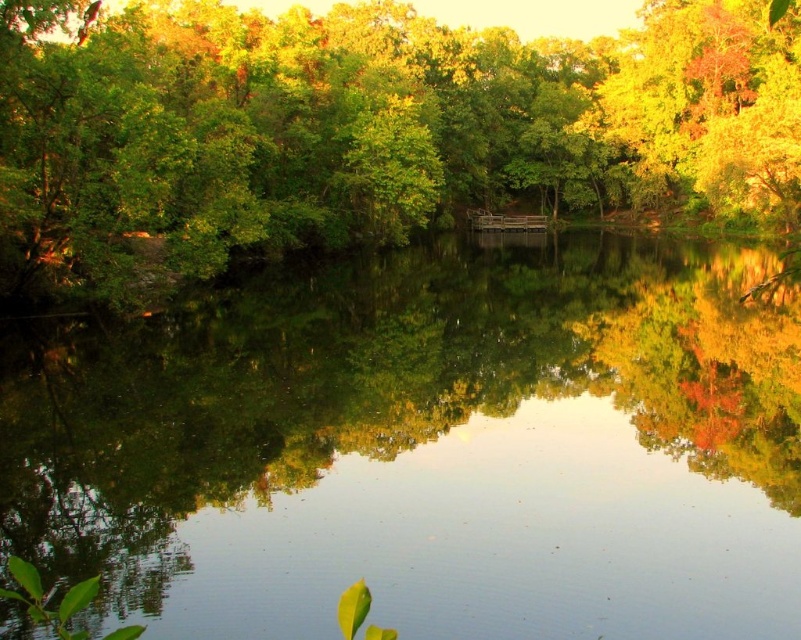
You are standing at the edge of the pond and want to locate the point at coordinates (x=425, y=448). Based on the scene description, where would this point be located in relation to the wooden structure?

The point at coordinates (x=425, y=448) is on clear water at center, so it is located in the middle of the pond away from the wooden structure extending into the water.

You are planning to build a small boat that is 3 meters wide. You want to navigate it through the clear water at center. Considering the green leafy tree at center, will the boat fit through the space between them?

The clear water at center is narrower than the green leafy tree at center. Since the boat is 3 meters wide, it might not fit through the narrow space of the clear water at center. You may need to choose a different route or a smaller boat.

You are standing on the wooden structure in the scene and notice the clear water at center and the green leafy tree at center. Which object appears smaller in size?

The clear water at center appears smaller in size compared to the green leafy tree at center according to the description.